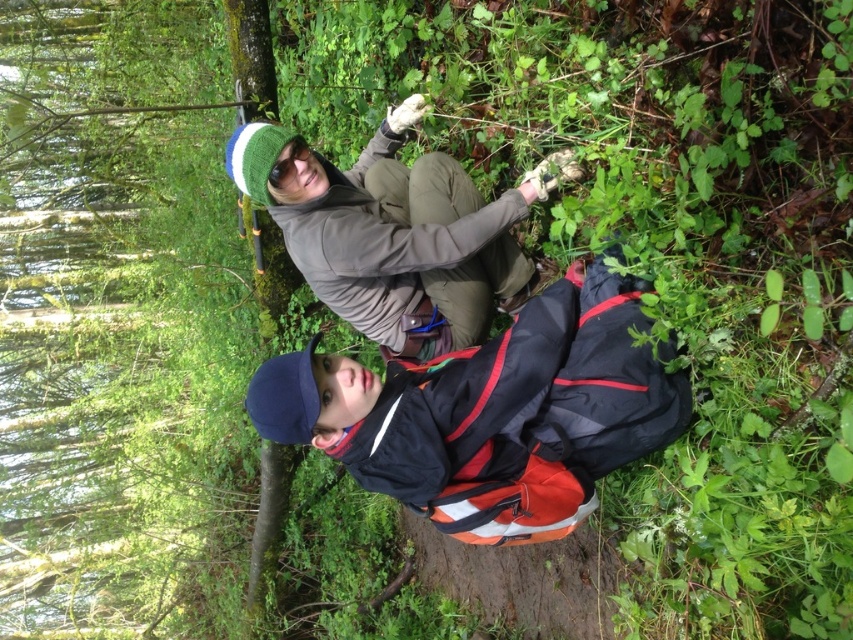
Is reflective blue jacket at lower center smaller than matte gray jacket at upper center?

Correct, reflective blue jacket at lower center occupies less space than matte gray jacket at upper center.

Can you confirm if reflective blue jacket at lower center is wider than matte gray jacket at upper center?

Yes.

Who is more forward, (544,522) or (407,189)?

Point (544,522) is more forward.

Locate an element on the screen. reflective blue jacket at lower center is located at coordinates (492, 412).